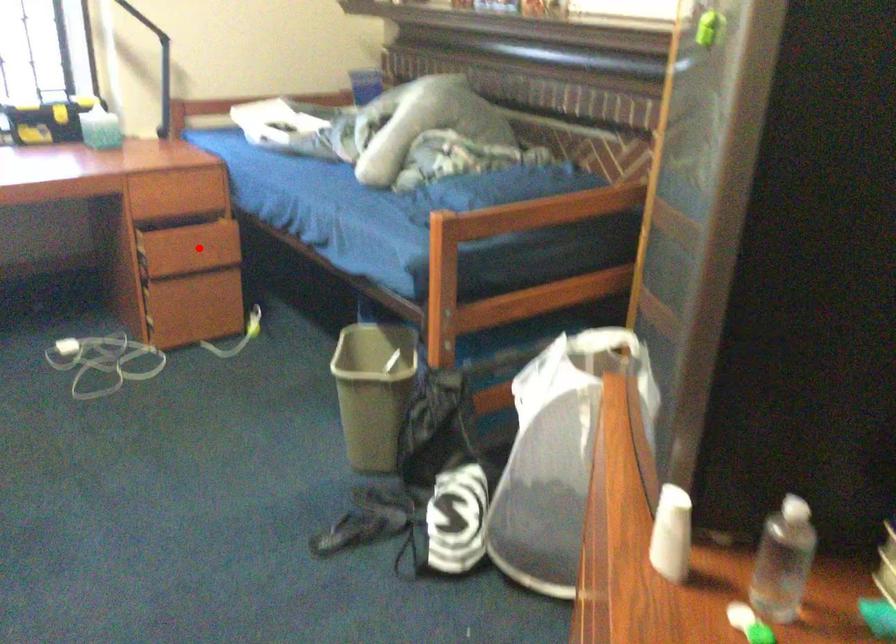
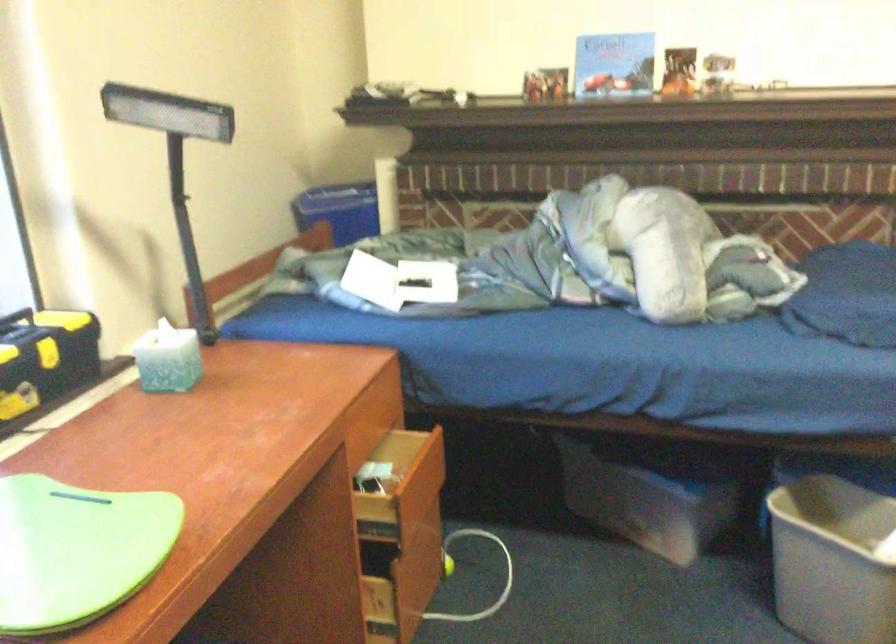
Question: I am providing you with two images of the same scene from different viewpoints. Image1 has a red point marked. In image2, the corresponding 3D location appears at what relative position? Reply with the corresponding letter.

Choices:
 (A) Closer
 (B) Farther

Answer: (A)